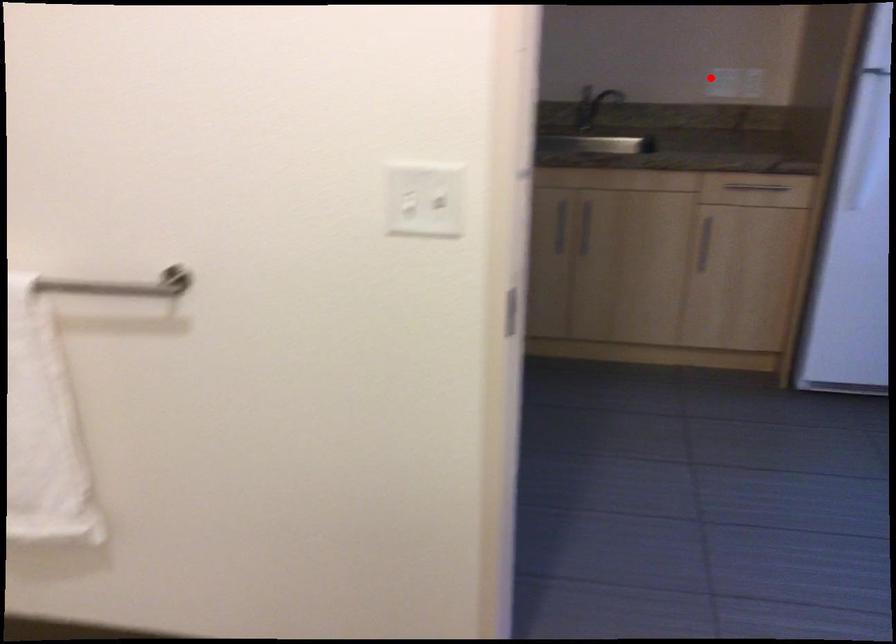
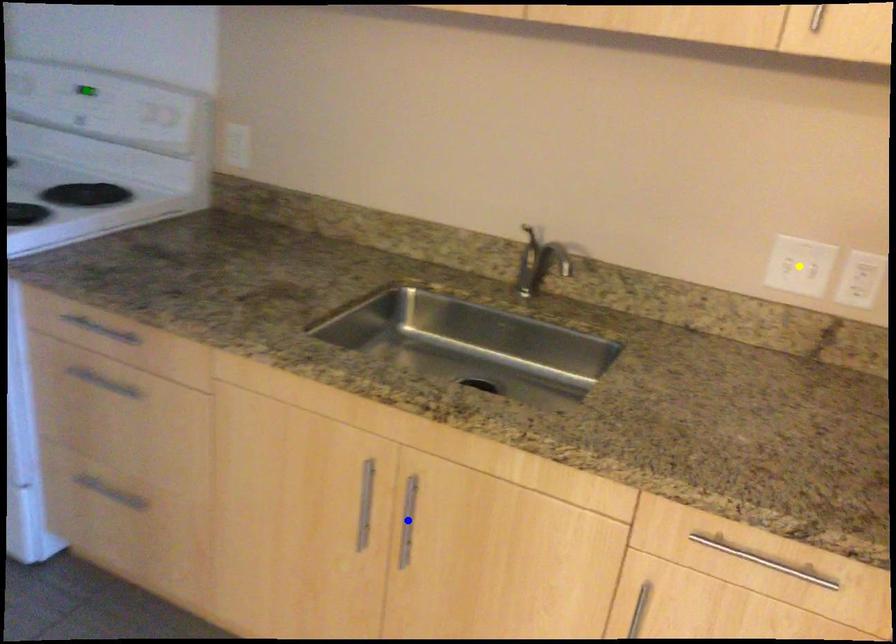
Question: I am providing you with two images of the same scene from different viewpoints. A red point is marked on the first image. You are given multiple points on the second image. Which mark in image 2 goes with the point in image 1?

Choices:
 (A) yellow point
 (B) green point
 (C) blue point

Answer: (A)